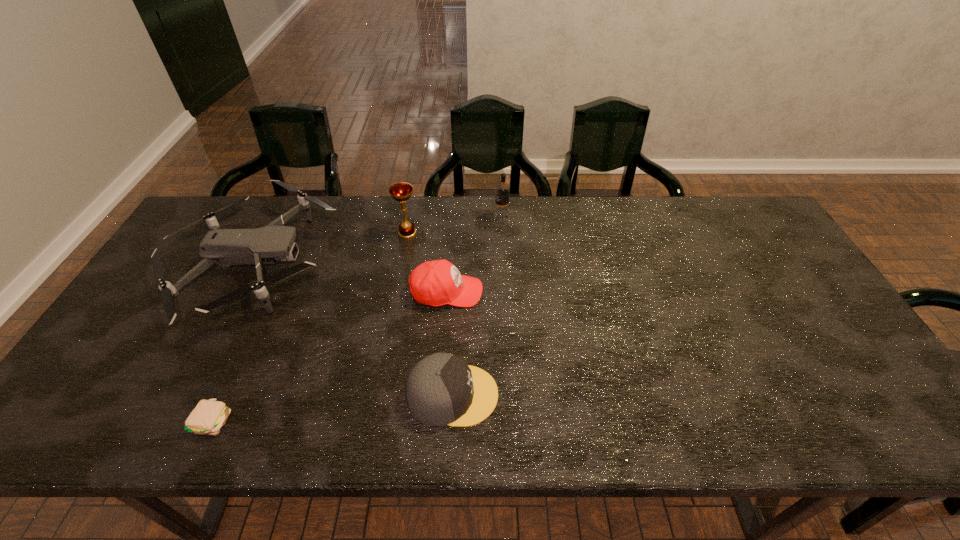
Locate an element on the screen. The image size is (960, 540). object located in the far left corner section of the desktop is located at coordinates (224, 247).

This screenshot has width=960, height=540. Find the location of `vacant region at the far edge of the desktop`. vacant region at the far edge of the desktop is located at coordinates (707, 220).

Locate an element on the screen. This screenshot has width=960, height=540. free space at the near edge is located at coordinates (755, 437).

Locate an element on the screen. The image size is (960, 540). free location at the left edge is located at coordinates (197, 259).

In the image, there is a desktop. At what (x,y) coordinates should I click in order to perform the action: click on vacant area at the right edge. Please return your answer as a coordinate pair (x, y). The height and width of the screenshot is (540, 960). Looking at the image, I should click on (854, 372).

In the image, there is a desktop. Where is `vacant space at the far right corner`? vacant space at the far right corner is located at coordinates (743, 197).

The width and height of the screenshot is (960, 540). Identify the location of empty space between the rightmost object and the patty. (357, 319).

This screenshot has width=960, height=540. I want to click on vacant area between the fourth object from right to left and the cap, so click(430, 314).

Where is `unoccupied position between the cap and the baseball cap`? The width and height of the screenshot is (960, 540). unoccupied position between the cap and the baseball cap is located at coordinates (450, 343).

Locate an element on the screen. The width and height of the screenshot is (960, 540). vacant space in between the patty and the vodka is located at coordinates (357, 319).